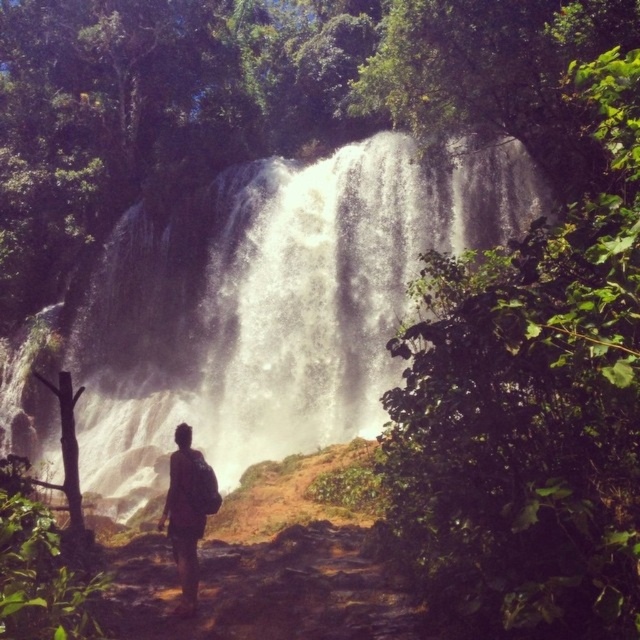
You are planning to cross the river near the waterfall. You see the white frothy water at center and the brown backpack at center. Which object is wider from your perspective?

The white frothy water at center is wider than the brown backpack at center.

You are a hiker who wants to cross the waterfall area. You see the white frothy water at center and the brown backpack at center. Which object is bigger and might make crossing more challenging?

The white frothy water at center is larger than the brown backpack at center, so it might make crossing more challenging.